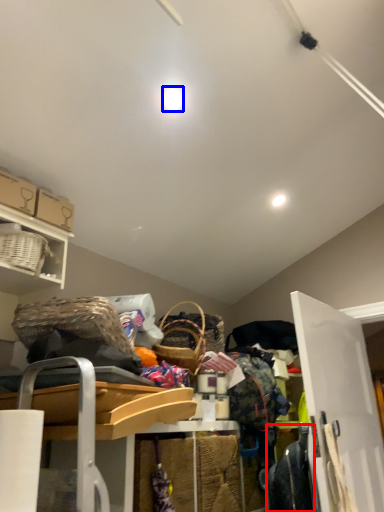
Question: Which object is closer to the camera taking this photo, clothing (highlighted by a red box) or light (highlighted by a blue box)?

Choices:
 (A) clothing
 (B) light

Answer: (B)